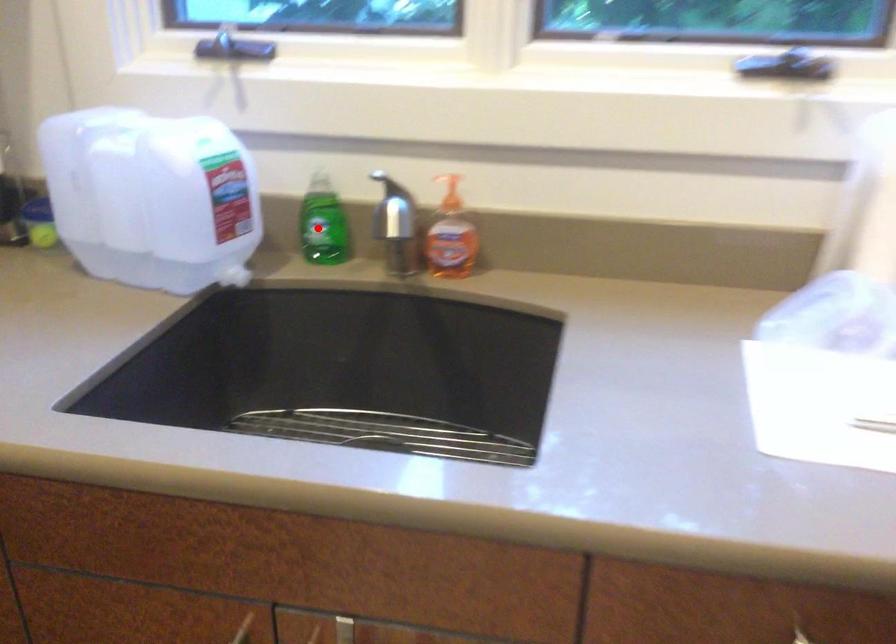
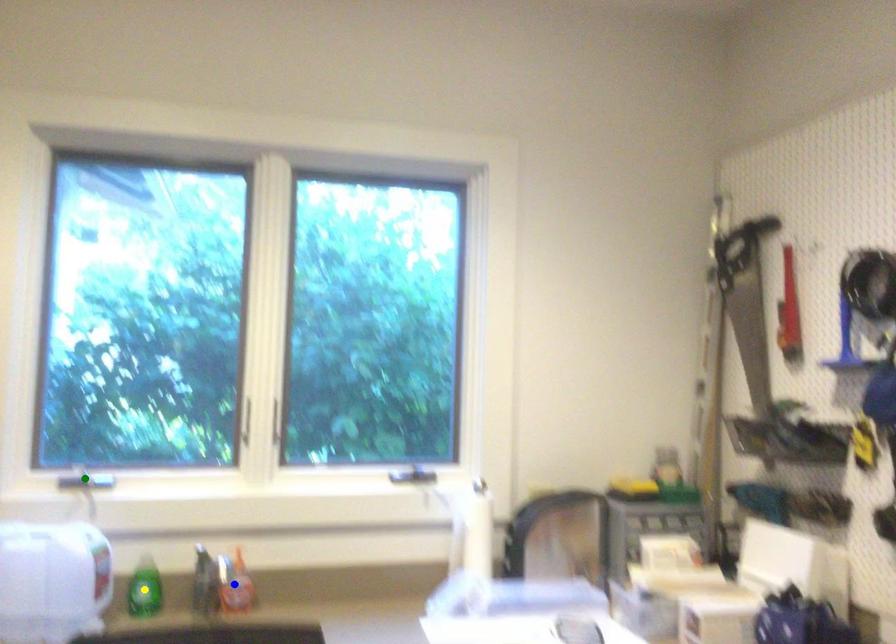
Question: I am providing you with two images of the same scene from different viewpoints. A red point is marked on the first image. You are given multiple points on the second image. Which point in image 2 represents the same 3d spot as the red point in image 1?

Choices:
 (A) blue point
 (B) green point
 (C) yellow point

Answer: (C)